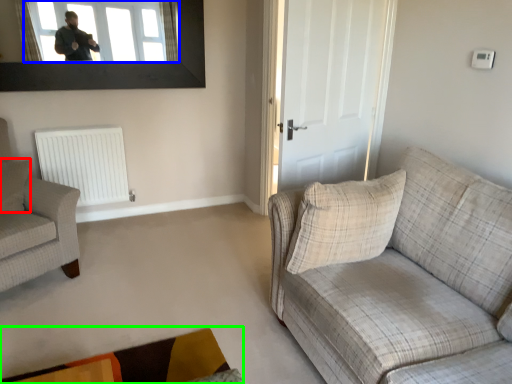
Question: Which object is positioned closest to pillow (highlighted by a red box)? Select from window (highlighted by a blue box) and plain (highlighted by a green box).

Choices:
 (A) window
 (B) plain

Answer: (A)